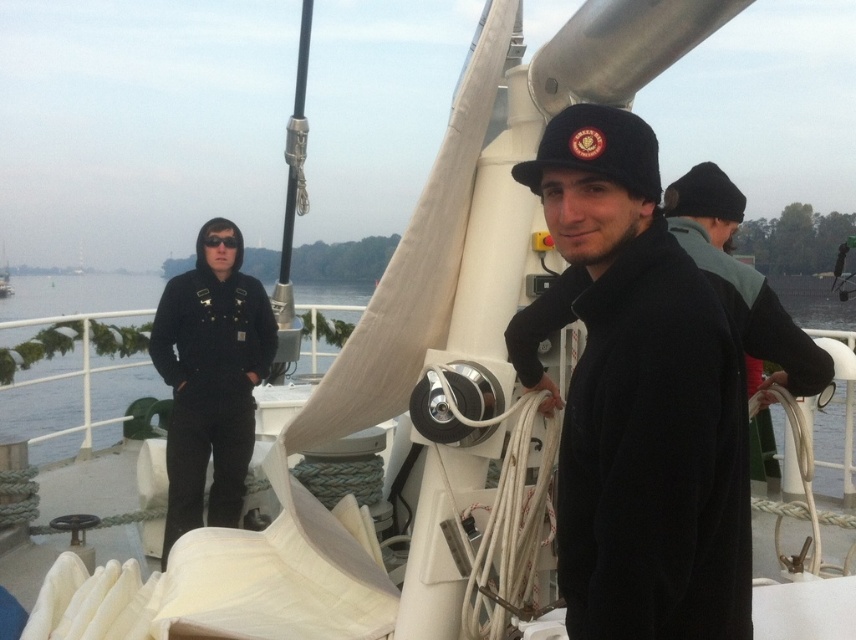
Question: Can you confirm if black fleece jacket at center is thinner than blue water at center?

Choices:
 (A) yes
 (B) no

Answer: (A)

Question: In this image, where is black fleece jacket at left located relative to blue water at center?

Choices:
 (A) above
 (B) below

Answer: (B)

Question: Where is black fleece jacket at left located in relation to blue water at center in the image?

Choices:
 (A) above
 (B) below

Answer: (B)

Question: Among these objects, which one is nearest to the camera?

Choices:
 (A) black fleece jacket at left
 (B) blue water at center

Answer: (A)

Question: Which point appears closest to the camera in this image?

Choices:
 (A) (301, 349)
 (B) (214, 364)
 (C) (643, 486)

Answer: (C)

Question: Which object is closer to the camera taking this photo?

Choices:
 (A) blue water at center
 (B) black fleece jacket at center
 (C) black fleece jacket at left

Answer: (B)